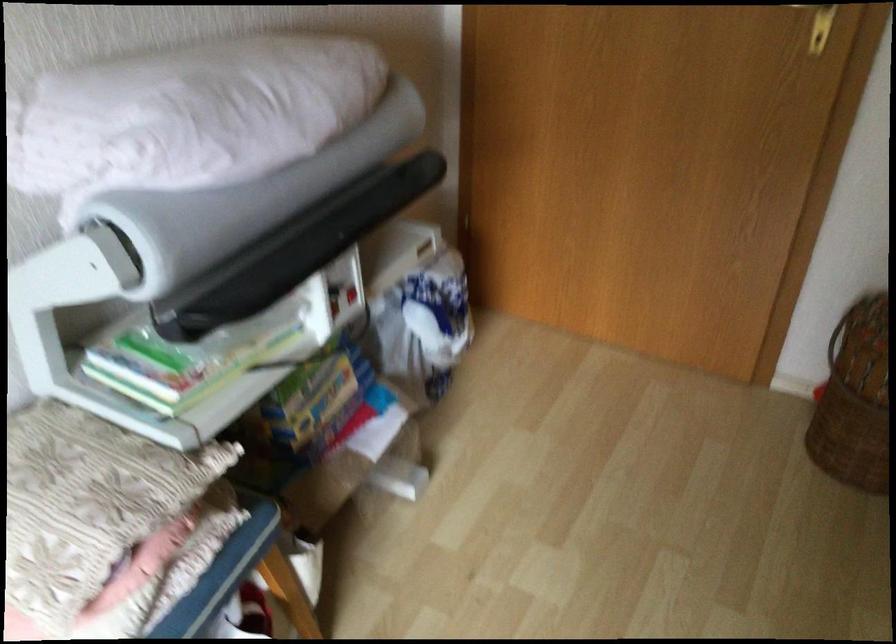
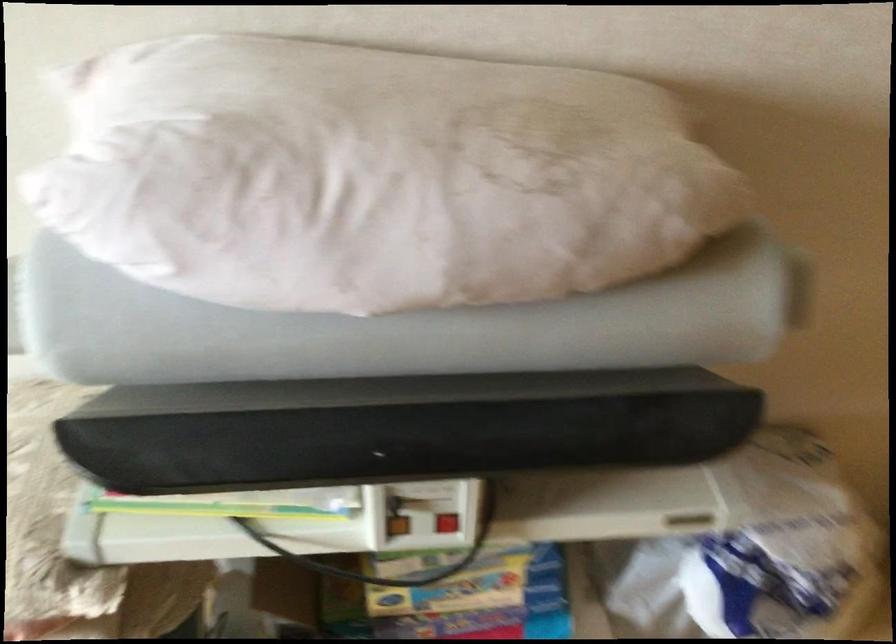
First-person continuous shooting, in which direction is the camera rotating?

The rotation direction of the camera is left-down.